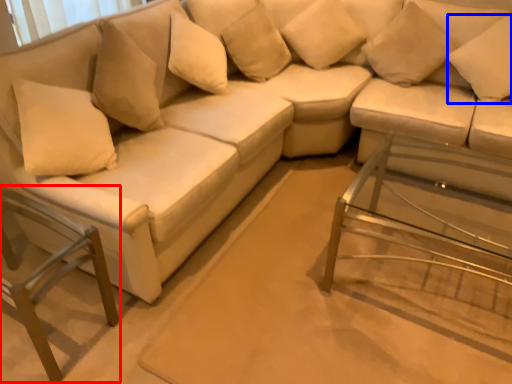
Question: Which object is closer to the camera taking this photo, swivel chair (highlighted by a red box) or pillow (highlighted by a blue box)?

Choices:
 (A) swivel chair
 (B) pillow

Answer: (A)